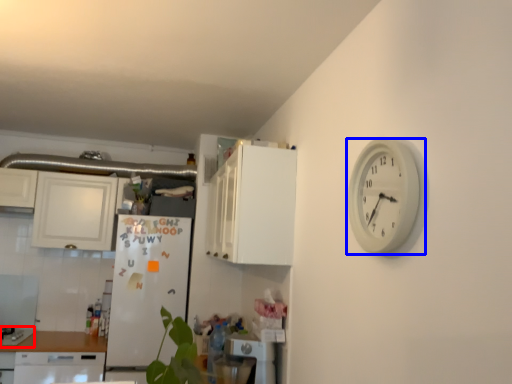
Question: Which object appears farthest to the camera in this image, gas stove (highlighted by a red box) or wall clock (highlighted by a blue box)?

Choices:
 (A) gas stove
 (B) wall clock

Answer: (A)